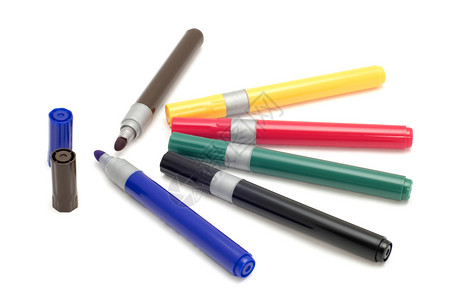
The width and height of the screenshot is (451, 300). Find the location of `marker`. marker is located at coordinates (213, 249), (314, 230), (327, 179), (282, 134), (261, 94), (156, 92).